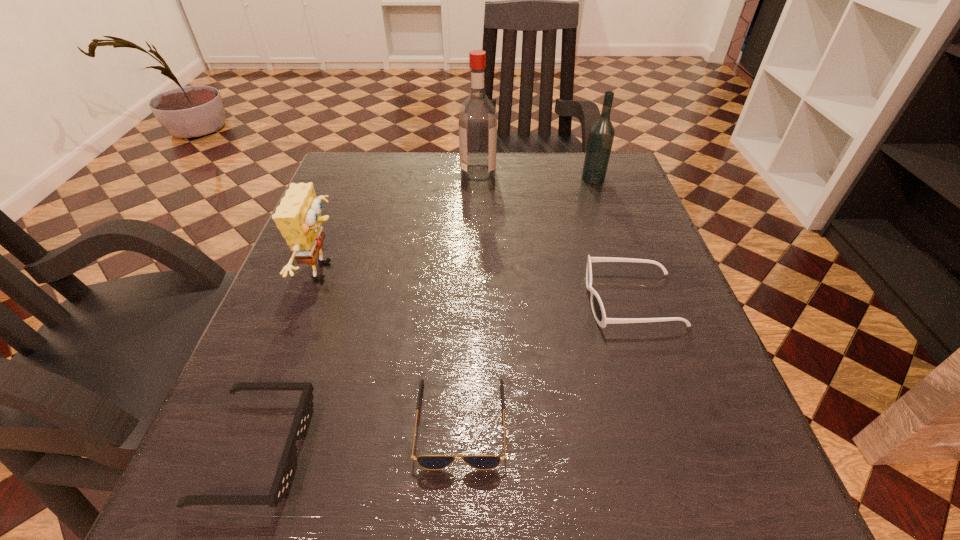
Locate an element on the screen. Image resolution: width=960 pixels, height=540 pixels. object that is at the near left corner is located at coordinates (285, 473).

Image resolution: width=960 pixels, height=540 pixels. I want to click on object that is at the far right corner, so click(601, 135).

Find the location of `vacant space at the far edge of the desktop`. vacant space at the far edge of the desktop is located at coordinates (x=435, y=152).

In the image, there is a desktop. Identify the location of vacant space at the left edge. This screenshot has height=540, width=960. (279, 332).

Locate an element on the screen. vacant space at the right edge of the desktop is located at coordinates (663, 264).

Image resolution: width=960 pixels, height=540 pixels. In order to click on vacant space at the far left corner in this screenshot , I will do `click(376, 181)`.

I want to click on vacant space at the far right corner of the desktop, so click(612, 153).

You are a GUI agent. You are given a task and a screenshot of the screen. Output one action in this format:
    pyautogui.click(x=<x>, y=<y>)
    Task: Click on the vacant area that lies between the leftmost sunglasses and the farthest sunglasses
    
    Given the screenshot: What is the action you would take?
    pyautogui.click(x=444, y=375)

Where is `free space between the tallest object and the second sunglasses from right to left`? Image resolution: width=960 pixels, height=540 pixels. free space between the tallest object and the second sunglasses from right to left is located at coordinates (469, 298).

The height and width of the screenshot is (540, 960). I want to click on vacant space that's between the third shortest object and the leftmost sunglasses, so click(444, 375).